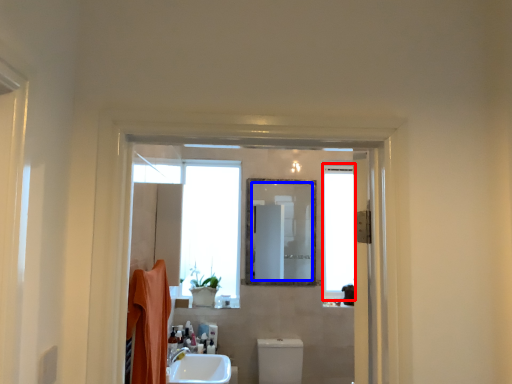
Question: Which point is further to the camera, window (highlighted by a red box) or mirror (highlighted by a blue box)?

Choices:
 (A) window
 (B) mirror

Answer: (A)